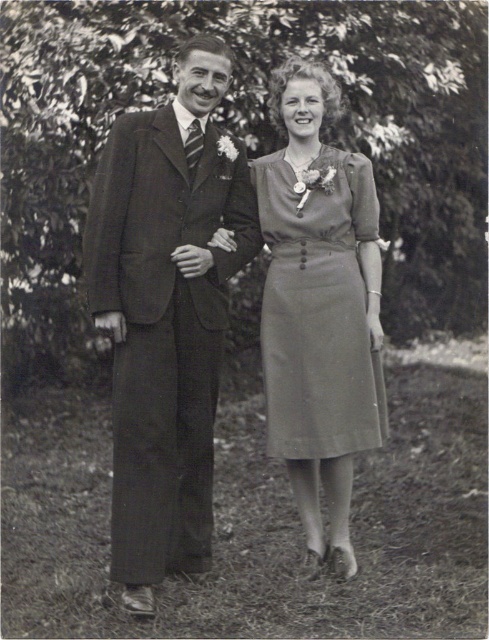
Question: In this image, where is matte dark suit at left located relative to matte gray dress at center?

Choices:
 (A) above
 (B) below

Answer: (B)

Question: Where is matte dark suit at left located in relation to matte gray dress at center in the image?

Choices:
 (A) left
 (B) right

Answer: (A)

Question: Which of the following is the closest to the observer?

Choices:
 (A) (113, 262)
 (B) (313, 448)

Answer: (A)

Question: Can you confirm if matte dark suit at left is wider than matte gray dress at center?

Choices:
 (A) yes
 (B) no

Answer: (A)

Question: Which point appears closest to the camera in this image?

Choices:
 (A) (205, 198)
 (B) (286, 236)

Answer: (A)